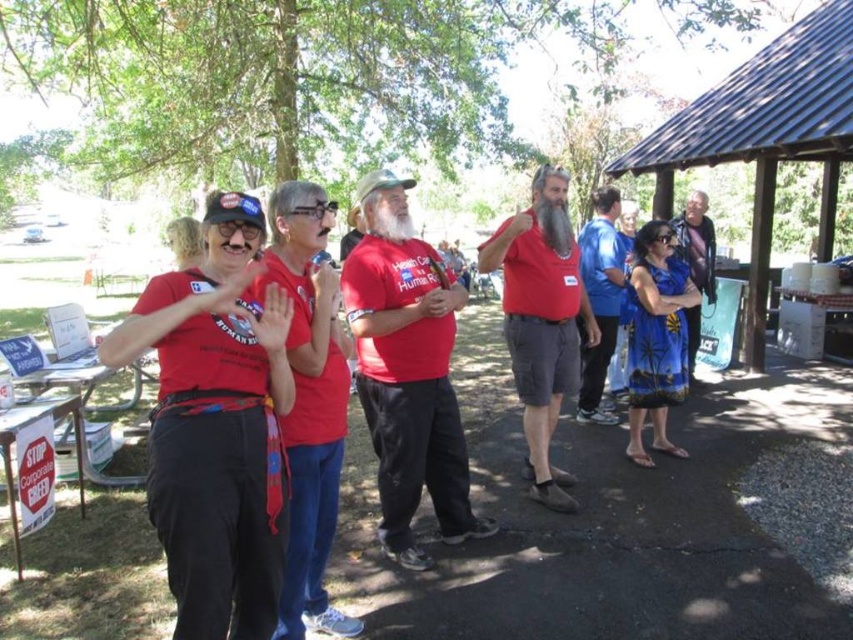
Does blue shirt at right appear under blue silk dress at right?

Indeed, blue shirt at right is positioned under blue silk dress at right.

Is point (596, 282) positioned behind point (703, 192)?

No.

What are the coordinates of `blue shirt at right` in the screenshot? It's located at (599, 300).

Does matte red tank top at center appear on the right side of blue silk dress at right?

Incorrect, matte red tank top at center is not on the right side of blue silk dress at right.

Between matte red tank top at center and blue silk dress at right, which one has more height?

matte red tank top at center

Which is behind, point (573, 291) or point (709, 266)?

The point (709, 266) is behind.

Locate an element on the screen. This screenshot has height=640, width=853. matte red tank top at center is located at coordinates (541, 320).

Which is more to the right, matte red t-shirt at center or blue shirt at right?

Positioned to the right is blue shirt at right.

Is matte red t-shirt at center to the right of blue shirt at right from the viewer's perspective?

In fact, matte red t-shirt at center is to the left of blue shirt at right.

Which is behind, point (358, 348) or point (613, 211)?

The point (613, 211) is more distant.

Find the location of a particular element. matte red t-shirt at center is located at coordinates (407, 371).